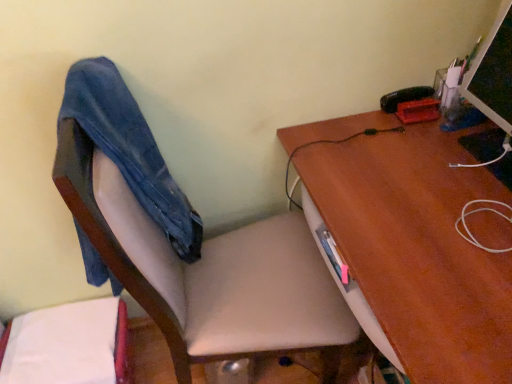
The width and height of the screenshot is (512, 384). In order to click on smooth beige chair at center in this screenshot , I will do `click(189, 243)`.

Image resolution: width=512 pixels, height=384 pixels. In order to click on denim at left in this screenshot , I will do `click(127, 150)`.

Is denim at left aimed at matte black monitor at upper right?

Yes, denim at left is aimed at matte black monitor at upper right.

Would you say matte black monitor at upper right is part of denim at left's contents?

No, matte black monitor at upper right is not surrounded by denim at left.

Which is behind, point (82, 132) or point (498, 107)?

The point (498, 107) is more distant.

Who is shorter, denim at left or matte black monitor at upper right?

matte black monitor at upper right is shorter.

Does brown wood desk at upper right appear on the right side of matte black monitor at upper right?

In fact, brown wood desk at upper right is to the left of matte black monitor at upper right.

From the image's perspective, does brown wood desk at upper right appear higher than matte black monitor at upper right?

Incorrect, from the image's perspective, brown wood desk at upper right is lower than matte black monitor at upper right.

Considering the sizes of objects brown wood desk at upper right and matte black monitor at upper right in the image provided, who is wider, brown wood desk at upper right or matte black monitor at upper right?

With larger width is brown wood desk at upper right.

How many degrees apart are the facing directions of brown wood desk at upper right and matte black monitor at upper right?

1.07 degrees.

Is smooth beige chair at center positioned far away from matte black monitor at upper right?

That's not correct — smooth beige chair at center is a little close to matte black monitor at upper right.

Who is taller, smooth beige chair at center or matte black monitor at upper right?

Standing taller between the two is smooth beige chair at center.

Which of these two, smooth beige chair at center or matte black monitor at upper right, is bigger?

smooth beige chair at center.

Is smooth beige chair at center outside of matte black monitor at upper right?

smooth beige chair at center lies outside matte black monitor at upper right's area.

Is brown wood desk at upper right next to smooth beige chair at center and touching it?

brown wood desk at upper right and smooth beige chair at center are not in contact.

Find the location of `desk below the smooth beige chair at center (from the image's perspective)`. desk below the smooth beige chair at center (from the image's perspective) is located at coordinates (418, 249).

Can we say brown wood desk at upper right lies outside smooth beige chair at center?

Yes.

Which is more to the left, brown wood desk at upper right or smooth beige chair at center?

smooth beige chair at center.

Does denim at left appear on the left side of brown wood desk at upper right?

Yes.

I want to click on desk located below the denim at left (from the image's perspective), so click(418, 249).

Does denim at left have a lesser width compared to brown wood desk at upper right?

Indeed, denim at left has a lesser width compared to brown wood desk at upper right.

Which of these two, denim at left or brown wood desk at upper right, stands shorter?

denim at left.

Is matte black monitor at upper right thinner than brown wood desk at upper right?

Yes.

Are matte black monitor at upper right and brown wood desk at upper right beside each other?

They are not placed beside each other.

Is matte black monitor at upper right positioned with its back to brown wood desk at upper right?

That's not correct — matte black monitor at upper right is not looking away from brown wood desk at upper right.

Locate an element on the screen. The height and width of the screenshot is (384, 512). computer monitor behind the brown wood desk at upper right is located at coordinates (x=493, y=73).

Which of these two, matte black monitor at upper right or smooth beige chair at center, stands taller?

smooth beige chair at center is taller.

Between point (489, 116) and point (188, 203), which one is positioned behind?

The point (188, 203) is more distant.

Considering the relative sizes of matte black monitor at upper right and smooth beige chair at center in the image provided, is matte black monitor at upper right bigger than smooth beige chair at center?

Incorrect, matte black monitor at upper right is not larger than smooth beige chair at center.

Does matte black monitor at upper right come in front of smooth beige chair at center?

No, matte black monitor at upper right is further to the viewer.

Identify the location of computer monitor above the denim at left (from a real-world perspective). This screenshot has height=384, width=512. (493, 73).

In the image, there is a matte black monitor at upper right. Where is `desk below it (from a real-world perspective)`? This screenshot has width=512, height=384. desk below it (from a real-world perspective) is located at coordinates (418, 249).

From the image, which object appears to be farther from denim at left, smooth beige chair at center or brown wood desk at upper right?

Among the two, brown wood desk at upper right is located further to denim at left.

Estimate the real-world distances between objects in this image. Which object is further from denim at left, smooth beige chair at center or matte black monitor at upper right?

matte black monitor at upper right is positioned further to the anchor denim at left.

Based on their spatial positions, is matte black monitor at upper right or smooth beige chair at center further from brown wood desk at upper right?

smooth beige chair at center.

Considering their positions, is brown wood desk at upper right positioned further to smooth beige chair at center than matte black monitor at upper right?

matte black monitor at upper right.

Considering their positions, is denim at left positioned further to matte black monitor at upper right than smooth beige chair at center?

denim at left is further to matte black monitor at upper right.

Considering their positions, is denim at left positioned further to brown wood desk at upper right than matte black monitor at upper right?

denim at left lies further to brown wood desk at upper right than the other object.

When comparing their distances from brown wood desk at upper right, does matte black monitor at upper right or denim at left seem closer?

matte black monitor at upper right is positioned closer to the anchor brown wood desk at upper right.

Which object lies nearer to the anchor point smooth beige chair at center, denim at left or matte black monitor at upper right?

denim at left is closer to smooth beige chair at center.

What are the coordinates of `desk between smooth beige chair at center and matte black monitor at upper right from left to right` in the screenshot? It's located at (418, 249).

Locate an element on the screen. chair located between denim at left and matte black monitor at upper right in the left-right direction is located at coordinates (189, 243).

Locate an element on the screen. desk between denim at left and matte black monitor at upper right in the horizontal direction is located at coordinates (418, 249).

Where is `chair between denim at left and brown wood desk at upper right in the horizontal direction`? The width and height of the screenshot is (512, 384). chair between denim at left and brown wood desk at upper right in the horizontal direction is located at coordinates pyautogui.click(x=189, y=243).